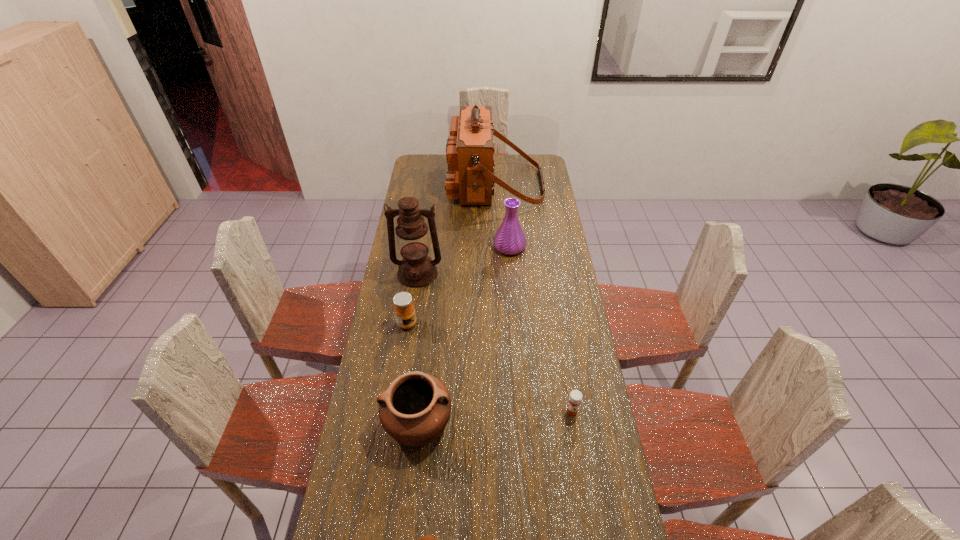
The height and width of the screenshot is (540, 960). What are the coordinates of `vacant area located on the face side of the farthest object` in the screenshot? It's located at click(x=431, y=185).

The width and height of the screenshot is (960, 540). Find the location of `free space located 0.080m on the back of the oil lamp`. free space located 0.080m on the back of the oil lamp is located at coordinates (421, 249).

Where is `vacant space located on the left of the second farthest object`? vacant space located on the left of the second farthest object is located at coordinates (433, 247).

Image resolution: width=960 pixels, height=540 pixels. I want to click on free region located 0.340m on the back of the pottery, so click(x=429, y=316).

Image resolution: width=960 pixels, height=540 pixels. I want to click on vacant space located on the front-facing side of the honey, so click(x=499, y=324).

At what (x,y) coordinates should I click in order to perform the action: click on vacant region located 0.240m on the label side of the medicine. Please return your answer as a coordinate pair (x, y). The height and width of the screenshot is (540, 960). Looking at the image, I should click on (586, 494).

At what (x,y) coordinates should I click in order to perform the action: click on object at the far edge. Please return your answer as a coordinate pair (x, y). Looking at the image, I should click on (470, 177).

Where is `oil lamp present at the left edge`? This screenshot has width=960, height=540. oil lamp present at the left edge is located at coordinates (x=416, y=269).

Identify the location of pottery situated at the left edge. The height and width of the screenshot is (540, 960). (414, 409).

At what (x,y) coordinates should I click in order to perform the action: click on honey that is at the left edge. Please return your answer as a coordinate pair (x, y). This screenshot has height=540, width=960. Looking at the image, I should click on (404, 310).